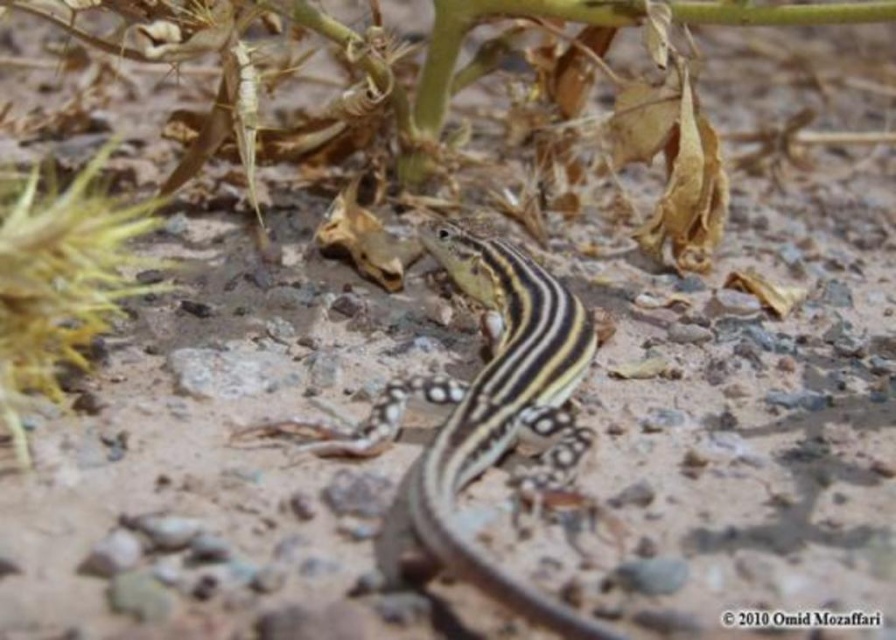
You are a researcher studying desert reptiles. You have a map of the area with coordinates. The yellow striped lizard at center is located at coordinates 0.641, 0.544. If you want to place a tracking device on the ground directly behind the lizard, which coordinate pair would you use?

The tracking device should be placed at coordinates slightly behind the yellow striped lizard at center. Since the lizard is at point (x=487, y=410), moving directly behind it would adjust the x or y coordinate depending on the direction the lizard is facing. However, without knowing the exact orientation, a safe assumption is to place it at coordinates like (x=501, y=410) to be directly behind in the y axis.

You are a photographer trying to capture both the yellow striped lizard at center and the yellow fuzzy plant at left in a single frame. Based on their sizes, which one should you focus on first to ensure they both fit in the shot?

The yellow striped lizard at center is shorter than the yellow fuzzy plant at left, so you should focus on the yellow fuzzy plant at left first to ensure both fit in the shot since it is taller.